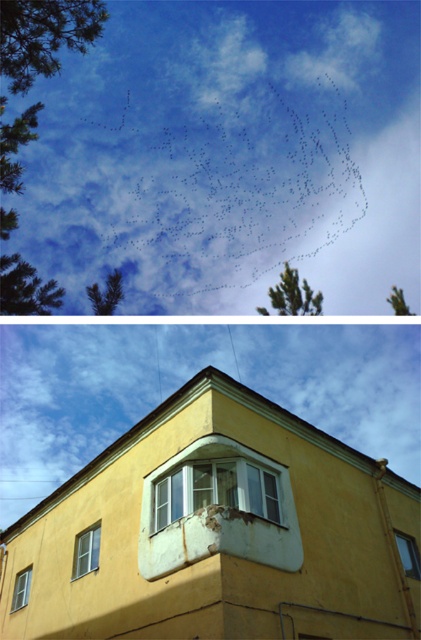
You are standing in a room with two windows. The white plastic window at center and the white glass window at upper center. Which window is positioned to the right side?

The white plastic window at center is positioned to the right of the white glass window at upper center.

You are an architect designing a new building and want to ensure that the white plastic window at center and the white glass window at upper center are spaced at least 8 meters apart. Based on the image provided, does the current spacing meet your requirement?

The white plastic window at center and the white glass window at upper center are 8.23 meters apart, which exceeds the minimum requirement of 8 meters. Therefore, the current spacing meets the requirement.

You are an observer looking at the sky scene in the top section. There are two points marked in the image, point 1 at coordinates point (266,488) and point 2 at point (21,582). Which point is closer to you?

Point (266,488) is closer to the viewer than point (21,582).